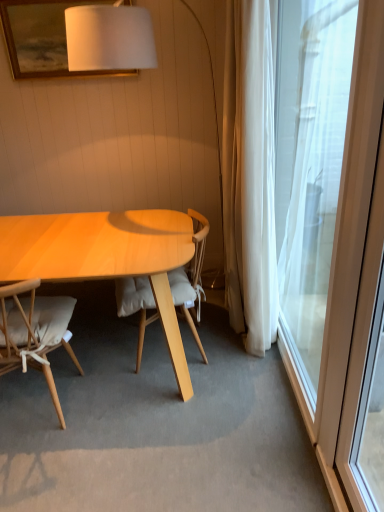
Where is `vacant space in between light brown wood chair at left, acting as the first chair starting from the left, and light wood/wooden chair at center, the 1th chair viewed from the right`? vacant space in between light brown wood chair at left, acting as the first chair starting from the left, and light wood/wooden chair at center, the 1th chair viewed from the right is located at coordinates (119, 387).